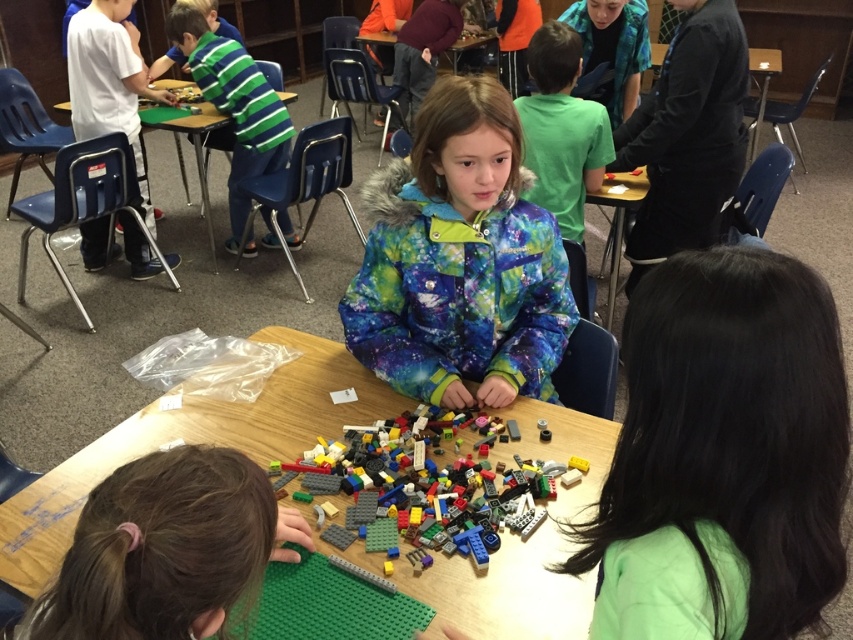
Question: Can you confirm if wooden table at center is thinner than blue plastic chair at left?

Choices:
 (A) no
 (B) yes

Answer: (A)

Question: Which point is closer to the camera?

Choices:
 (A) green matte lego at lower left
 (B) green fabric jacket at center
 (C) yellow plastic table at right
 (D) translucent plastic lego pieces at center

Answer: (A)

Question: Considering the relative positions of yellow plastic table at right and black plastic table at upper right in the image provided, where is yellow plastic table at right located with respect to black plastic table at upper right?

Choices:
 (A) below
 (B) above

Answer: (A)

Question: Which object is farther from the camera taking this photo?

Choices:
 (A) green fabric jacket at center
 (B) black plastic table at upper right
 (C) translucent plastic lego pieces at center
 (D) yellow plastic table at right

Answer: (B)

Question: Is green matte lego at lower left to the right of translucent plastic lego pieces at center from the viewer's perspective?

Choices:
 (A) yes
 (B) no

Answer: (B)

Question: Which point is farther to the camera?

Choices:
 (A) translucent plastic lego pieces at center
 (B) green fabric jacket at center

Answer: (B)